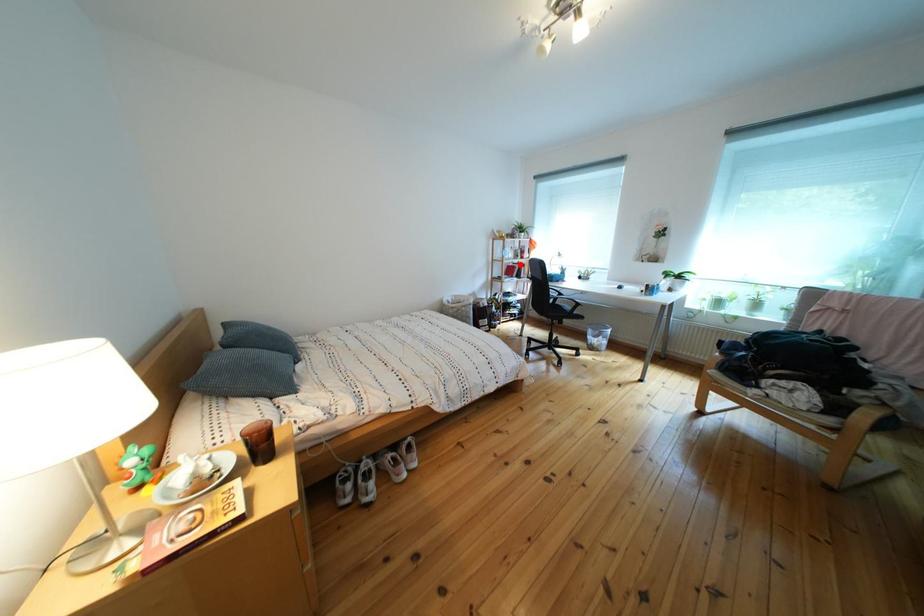
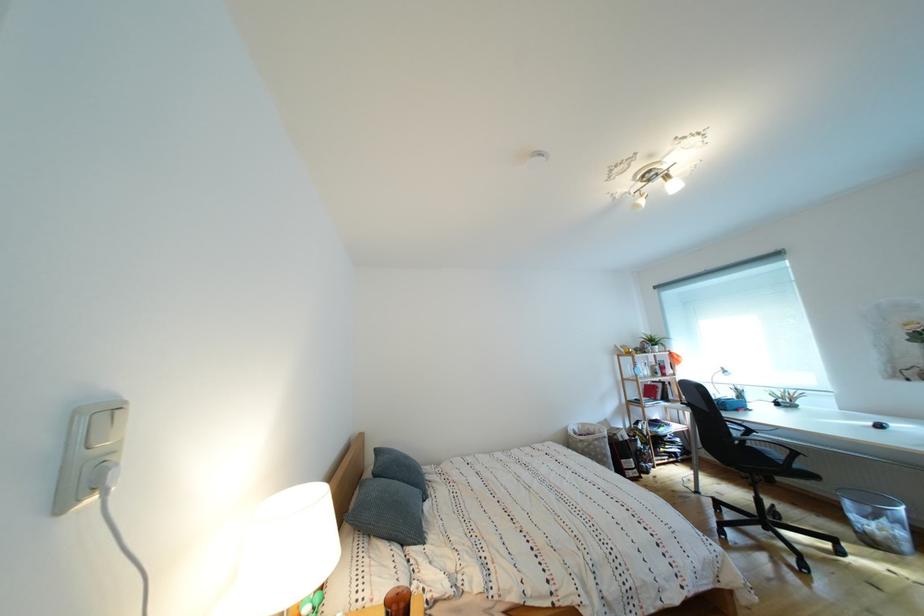
Question: I am providing you with two images of the same scene from different viewpoints. Image1 has a red point marked. In image2, the corresponding 3D location appears at what relative position? Reply with the corresponding letter.

Choices:
 (A) Closer
 (B) Farther

Answer: (B)